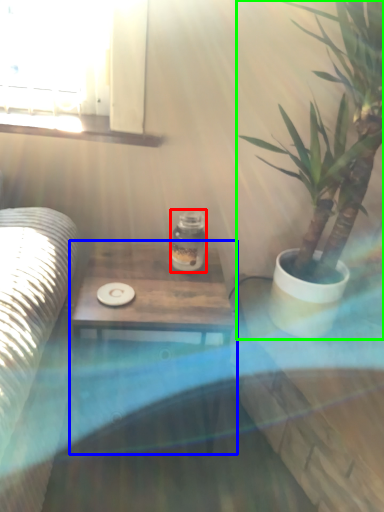
Question: Which object is the farthest from glass jar (highlighted by a red box)? Choose among these: table (highlighted by a blue box) or houseplant (highlighted by a green box).

Choices:
 (A) table
 (B) houseplant

Answer: (B)